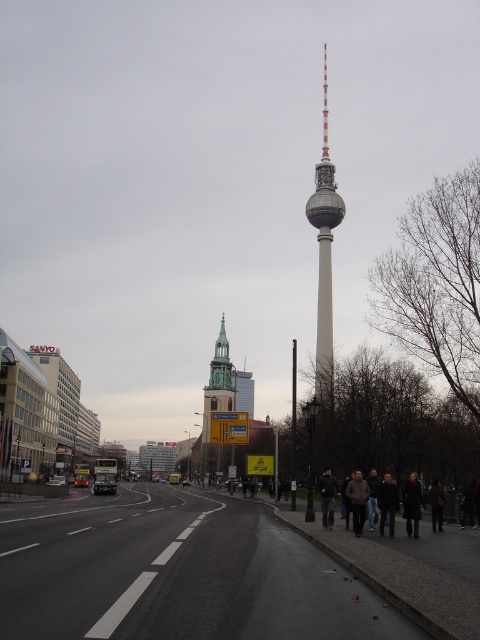
Question: Among these points, which one is nearest to the camera?

Choices:
 (A) (336, 486)
 (B) (324, 182)

Answer: (A)

Question: Which object appears farthest from the camera in this image?

Choices:
 (A) dark brown leather coat at lower right
 (B) white smooth tower at center

Answer: (B)

Question: Is white smooth tower at center thinner than green stone church steeple at center?

Choices:
 (A) no
 (B) yes

Answer: (A)

Question: Can you confirm if white smooth tower at center is thinner than green stone church steeple at center?

Choices:
 (A) yes
 (B) no

Answer: (B)

Question: Does white smooth tower at center appear on the right side of dark brown leather coat at lower right?

Choices:
 (A) no
 (B) yes

Answer: (B)

Question: Estimate the real-world distances between objects in this image. Which object is closer to the dark brown leather coat at lower right?

Choices:
 (A) green stone church steeple at center
 (B) dark gray jacket at center

Answer: (B)